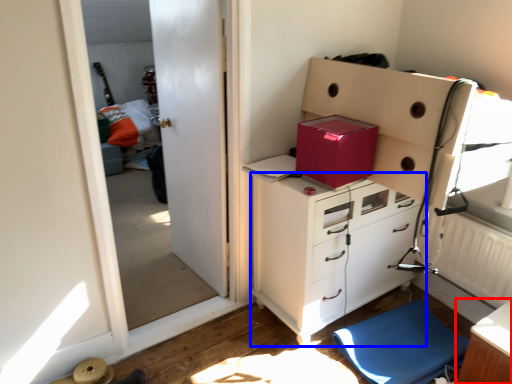
Question: Which object appears closest to the camera in this image, table (highlighted by a red box) or chest of drawers (highlighted by a blue box)?

Choices:
 (A) table
 (B) chest of drawers

Answer: (A)